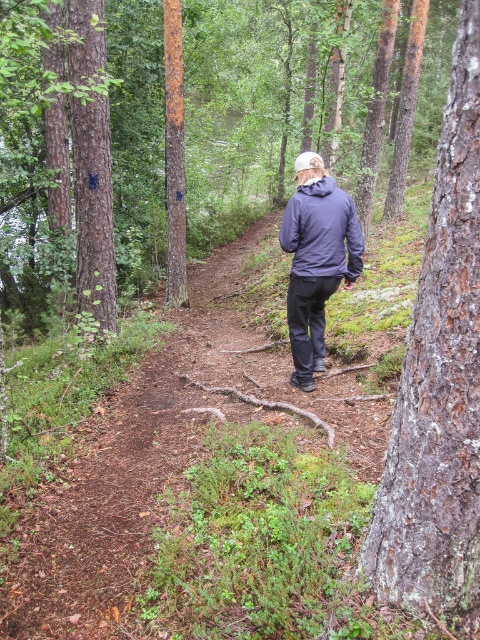
Question: Estimate the real-world distances between objects in this image. Which object is farther from the rusty metal tree at center?

Choices:
 (A) dark blue matte jacket at center
 (B) smooth brown tree trunk at left
 (C) dark blue jacket at center
 (D) rough bark tree at upper right

Answer: (A)

Question: Is smooth brown tree trunk at left to the left of dark blue jacket at center from the viewer's perspective?

Choices:
 (A) yes
 (B) no

Answer: (A)

Question: Based on their relative distances, which object is nearer to the smooth bark tree at right?

Choices:
 (A) rusty metal tree at center
 (B) dark blue jacket at center
 (C) smooth brown tree trunk at left

Answer: (B)

Question: Considering the relative positions of dark blue matte jacket at center and rusty metal tree at center in the image provided, where is dark blue matte jacket at center located with respect to rusty metal tree at center?

Choices:
 (A) above
 (B) below

Answer: (B)

Question: Which object is farther from the camera taking this photo?

Choices:
 (A) smooth brown tree trunk at left
 (B) rusty metal tree at center

Answer: (B)

Question: Does smooth bark tree at right have a smaller size compared to rusty metal tree at center?

Choices:
 (A) yes
 (B) no

Answer: (A)